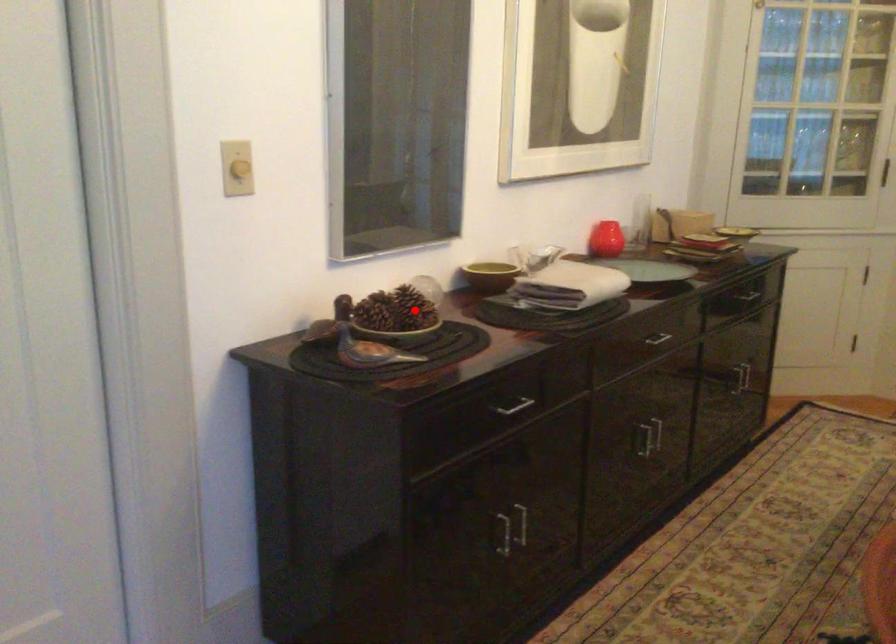
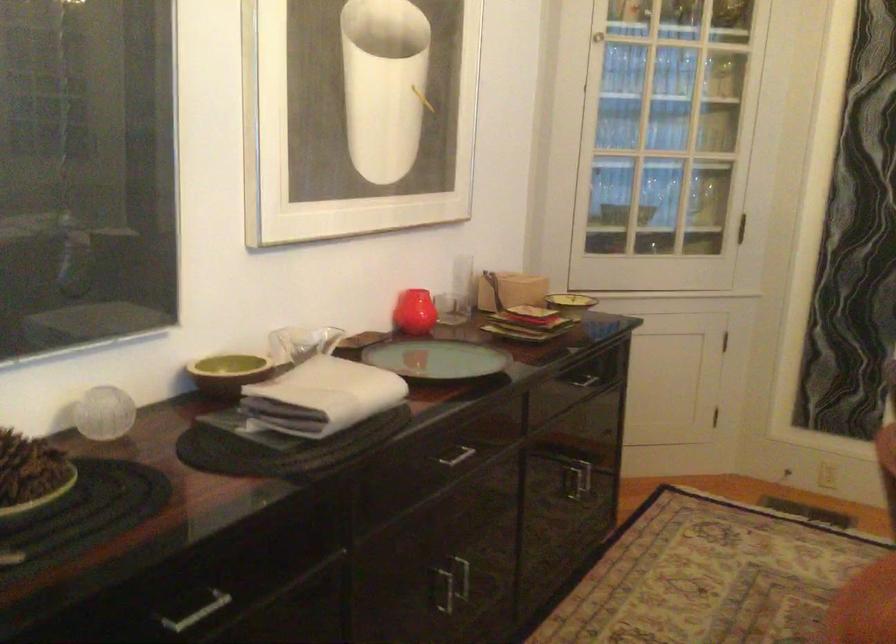
Find the pixel in the second image that matches the highlighted location in the first image.

(30, 475)